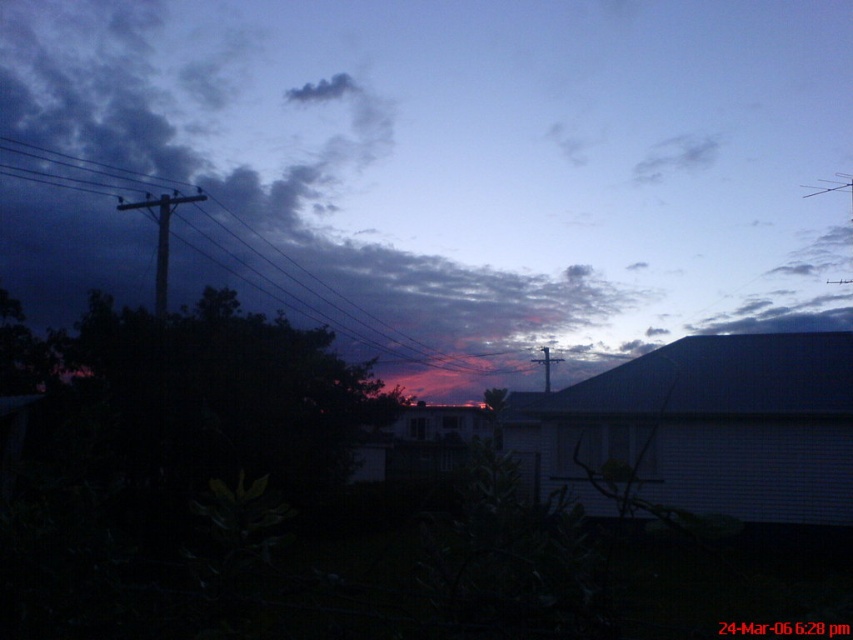
You are standing in the evening scene and notice the black wire at upper left and the smooth wooden telegraph pole at left. Which object is positioned to the right of the other?

The black wire at upper left is positioned to the right of the smooth wooden telegraph pole at left.

You are an artist sketching this scene. You want to draw the smooth wooden telegraph pole at left and the black wire at upper left accurately. Which object should you draw first to maintain proper perspective?

You should draw the black wire at upper left first because the smooth wooden telegraph pole at left is behind it, so the pole will be drawn over the wire to show correct layering.